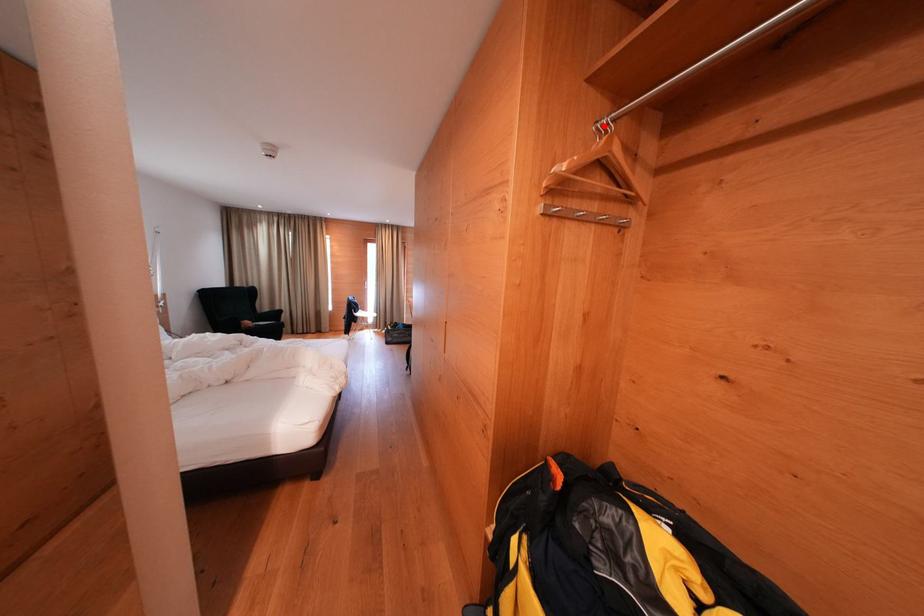
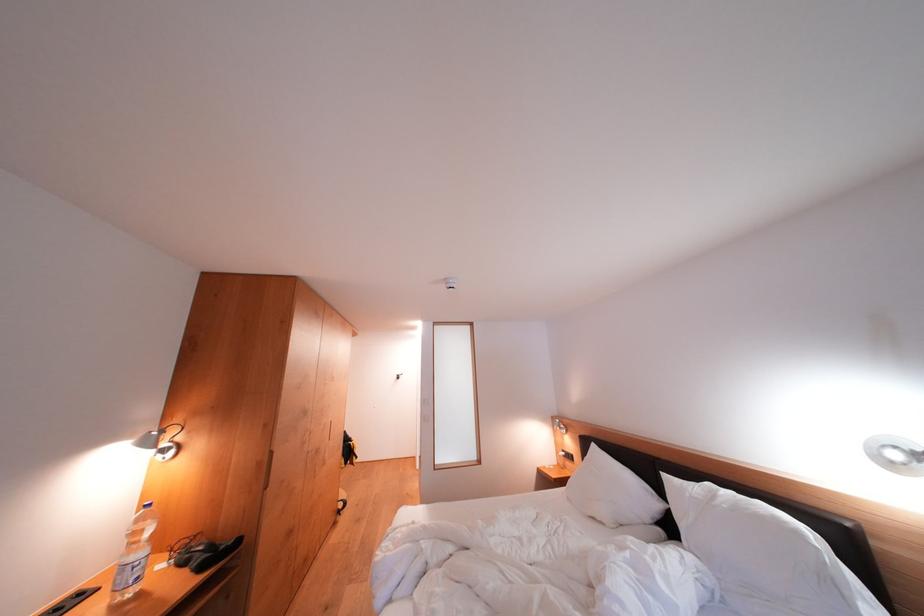
Question: I am providing you with two images of the same scene from different viewpoints. A red point is marked on the first image. Is the red point's position out of view in image 2?

Choices:
 (A) Yes
 (B) No

Answer: (A)